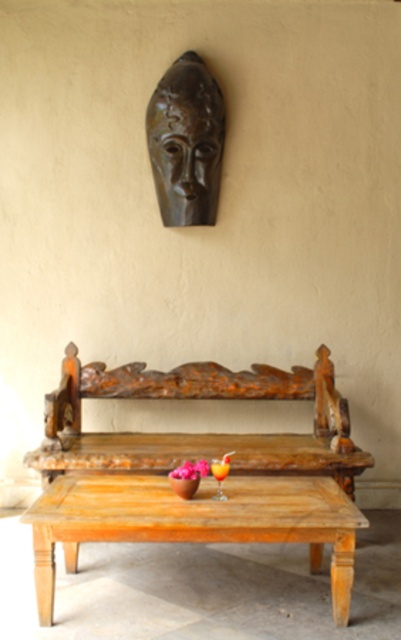
You are standing at the origin point in the image. Which direction should you move to reach the wooden table at center?

The wooden table at center is located at coordinates 0.814 on the x axis and 0.486 on the y axis, so you should move towards the right and slightly forward to reach it.

You are a guest at this rustic setting and want to place a book on the wooden table at center. However, you notice the wooden carved bench at center is in the way. Can you place the book on the table without moving the bench?

The wooden carved bench at center is above the wooden table at center, meaning the bench is positioned higher than the table. Since the bench is elevated, you can still place the book on the wooden table at center as long as there is space between them. The bench being above does not physically block access to the table.

You are standing at the point with coordinates (198, 433) in the image. What object is located exactly at your current position?

The wooden carved bench at center is located exactly at the point with coordinates (198, 433).